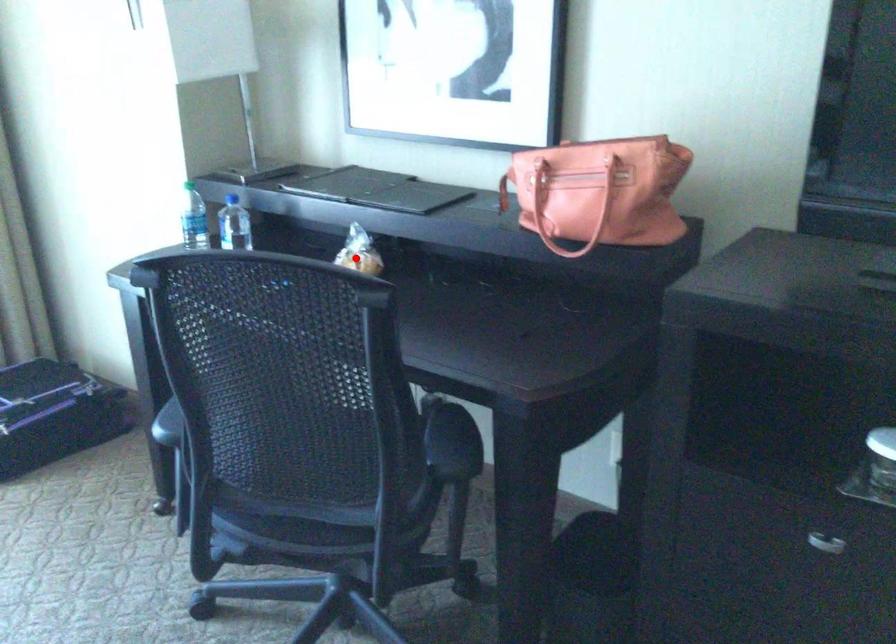
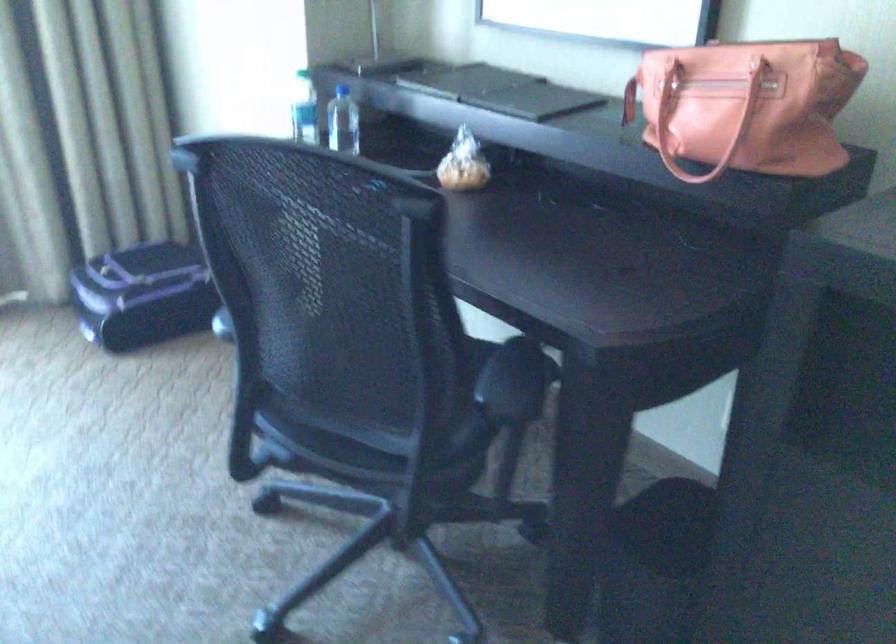
Find the pixel in the second image that matches the highlighted location in the first image.

(462, 164)